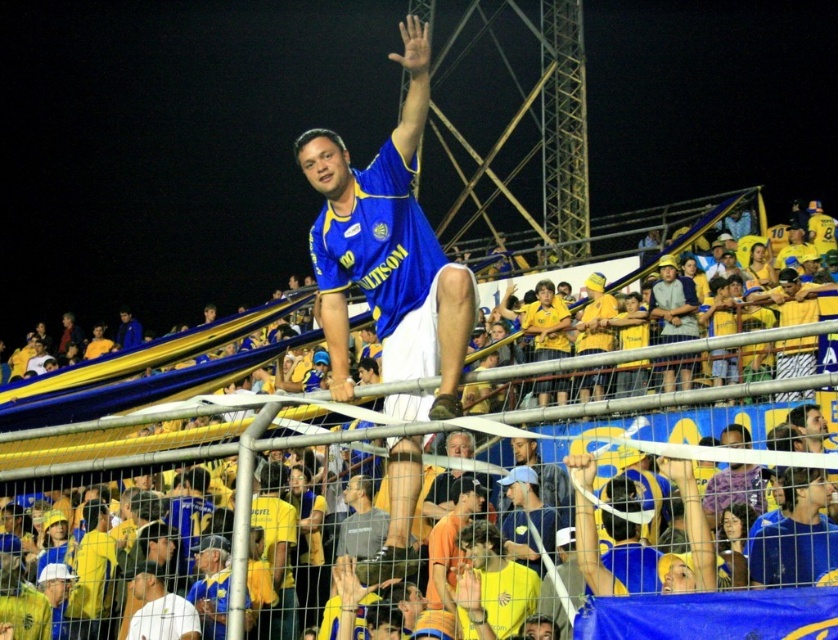
Question: Which object is farther from the camera taking this photo?

Choices:
 (A) blue jersey at center
 (B) yellow jersey at upper center

Answer: (A)

Question: Does blue jersey at center lie behind yellow jersey at upper center?

Choices:
 (A) yes
 (B) no

Answer: (A)

Question: Is blue jersey at center behind yellow jersey at upper center?

Choices:
 (A) no
 (B) yes

Answer: (B)

Question: Is blue jersey at center to the right of yellow jersey at upper center from the viewer's perspective?

Choices:
 (A) no
 (B) yes

Answer: (A)

Question: Which point is closer to the camera?

Choices:
 (A) yellow jersey at upper center
 (B) blue jersey at center

Answer: (A)